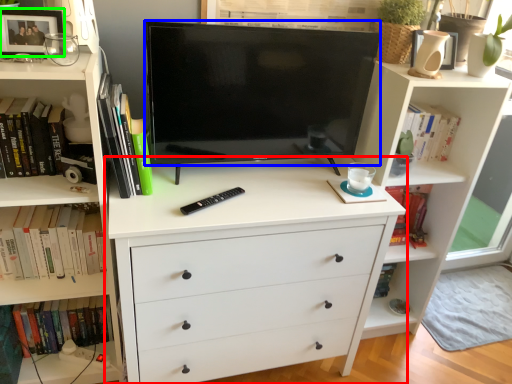
Question: Considering the real-world distances, which object is farthest from chest of drawers (highlighted by a red box)? television (highlighted by a blue box) or picture frame (highlighted by a green box)?

Choices:
 (A) television
 (B) picture frame

Answer: (B)